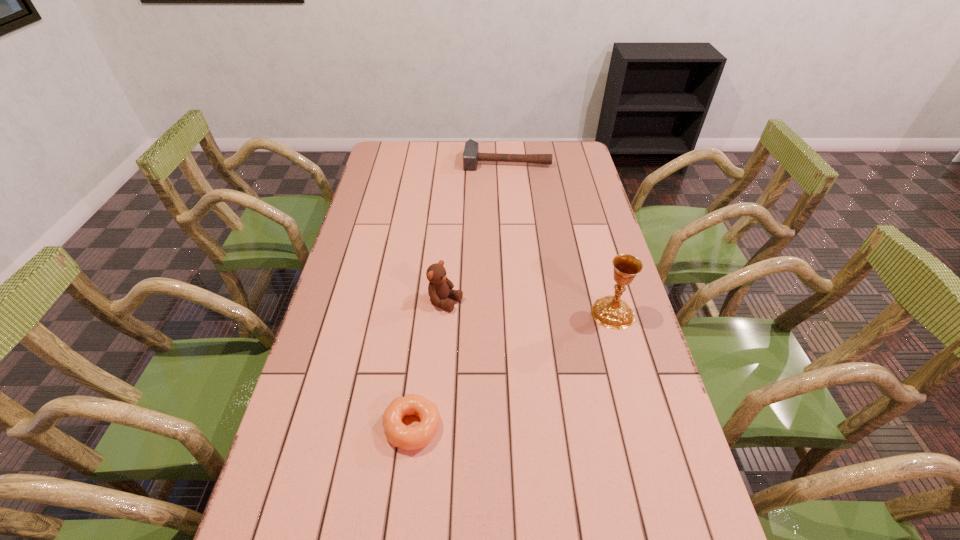
You are a GUI agent. You are given a task and a screenshot of the screen. Output one action in this format:
    pyautogui.click(x=<x>, y=<y>)
    Task: Click on the vacant space located on the face of the third shortest object
    
    Given the screenshot: What is the action you would take?
    pyautogui.click(x=512, y=331)

The height and width of the screenshot is (540, 960). What are the coordinates of `vacant space positioned on the striking surface of the farthest object` in the screenshot? It's located at tap(502, 217).

You are a GUI agent. You are given a task and a screenshot of the screen. Output one action in this format:
    pyautogui.click(x=<x>, y=<y>)
    Task: Click on the vacant space located 0.170m on the striking surface of the farthest object
    The image size is (960, 540).
    Given the screenshot: What is the action you would take?
    pyautogui.click(x=503, y=195)

The height and width of the screenshot is (540, 960). Find the location of `vacant space located on the striking surface of the farthest object`. vacant space located on the striking surface of the farthest object is located at coordinates (504, 188).

I want to click on object present at the far edge, so click(x=471, y=156).

I want to click on chalice that is at the right edge, so click(x=611, y=312).

The image size is (960, 540). What are the coordinates of `hammer situated at the right edge` in the screenshot? It's located at coord(471,156).

Where is `object that is positioned at the far right corner`? Image resolution: width=960 pixels, height=540 pixels. object that is positioned at the far right corner is located at coordinates [x=471, y=156].

Identify the location of free space at the far edge. (483, 165).

Locate an element on the screen. vacant space at the near edge is located at coordinates (402, 511).